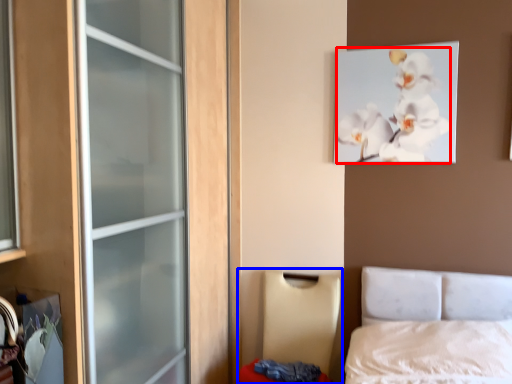
Question: Which object is closer to the camera taking this photo, flower (highlighted by a red box) or furniture (highlighted by a blue box)?

Choices:
 (A) flower
 (B) furniture

Answer: (B)